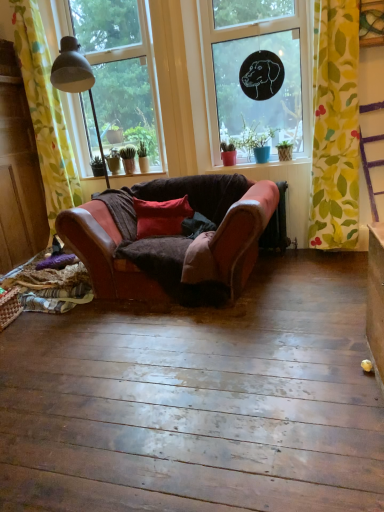
Describe the element at coordinates (120, 71) in the screenshot. I see `transparent glass window at upper left, which ranks as the 2th window in right-to-left order` at that location.

Measure the distance between leather couch at center and camera.

The distance of leather couch at center from camera is 2.50 meters.

What is the approximate height of yellow floral fabric at right, which appears as the first curtain when viewed from the right?

yellow floral fabric at right, which appears as the first curtain when viewed from the right, is 1.87 meters in height.

This screenshot has width=384, height=512. Find the location of `matte red pot at center`. matte red pot at center is located at coordinates (249, 139).

This screenshot has width=384, height=512. In order to click on curtain that is the 2nd one when counting forward from the matte red pot at center in this screenshot , I will do click(335, 126).

From the image's perspective, is yellow floral fabric at right, positioned as the second curtain in left-to-right order, below matte red pot at center?

Indeed, from the image's perspective, yellow floral fabric at right, positioned as the second curtain in left-to-right order, is shown beneath matte red pot at center.

Based on the photo, are yellow floral fabric at right, which appears as the first curtain when viewed from the right, and matte red pot at center far apart?

No, yellow floral fabric at right, which appears as the first curtain when viewed from the right, is not far from matte red pot at center.

Is green fabric at lower left turned away from matte red pot at center?

No, green fabric at lower left is not facing the opposite direction of matte red pot at center.

Is green fabric at lower left to the right of matte red pot at center from the viewer's perspective?

In fact, green fabric at lower left is to the left of matte red pot at center.

Between green fabric at lower left and matte red pot at center, which one is positioned in front?

matte red pot at center.

Is transparent glass window at upper center, arranged as the 2th window when viewed from the left, spatially inside matte red pot at center, or outside of it?

The correct answer is: outside.

How different are the orientations of transparent glass window at upper center, the 1th window when ordered from right to left, and matte red pot at center in degrees?

transparent glass window at upper center, the 1th window when ordered from right to left, and matte red pot at center are facing 0.0934 degrees away from each other.

Does transparent glass window at upper center, the 1th window when ordered from right to left, lie in front of matte red pot at center?

That is True.

Is transparent glass window at upper center, the 1th window when ordered from right to left, oriented towards green fabric at lower left?

No, transparent glass window at upper center, the 1th window when ordered from right to left, does not turn towards green fabric at lower left.

Looking at this image, based on their positions, is transparent glass window at upper center, arranged as the 2th window when viewed from the left, located to the left or right of green fabric at lower left?

From the image, it's evident that transparent glass window at upper center, arranged as the 2th window when viewed from the left, is to the right of green fabric at lower left.

Who is taller, transparent glass window at upper center, the 1th window when ordered from right to left, or green fabric at lower left?

transparent glass window at upper center, the 1th window when ordered from right to left, is taller.

Measure the distance from transparent glass window at upper center, arranged as the 2th window when viewed from the left, to green fabric at lower left.

They are 1.14 meters apart.

Based on their sizes in the image, would you say green fabric at lower left is bigger or smaller than transparent glass window at upper left, the first window positioned from the left?

In the image, green fabric at lower left appears to be smaller than transparent glass window at upper left, the first window positioned from the left.

At what (x,y) coordinates should I click in order to perform the action: click on window sill below the transparent glass window at upper left, the first window positioned from the left (from the image's perspective). Please return your answer as a coordinate pair (x, y). Looking at the image, I should click on (134, 178).

Is green fabric at lower left positioned with its back to transparent glass window at upper left, the first window positioned from the left?

green fabric at lower left does not have its back to transparent glass window at upper left, the first window positioned from the left.

Is green fabric at lower left wider than transparent glass window at upper left, the first window positioned from the left?

Correct, the width of green fabric at lower left exceeds that of transparent glass window at upper left, the first window positioned from the left.

Is green fabric at lower left surrounded by leather couch at center?

No.

You are a GUI agent. You are given a task and a screenshot of the screen. Output one action in this format:
    pyautogui.click(x=<x>, y=<y>)
    Task: Click on the studio couch lying on the right of green fabric at lower left
    
    Given the screenshot: What is the action you would take?
    pyautogui.click(x=173, y=240)

Is leather couch at center turned away from green fabric at lower left?

Yes, leather couch at center's orientation is away from green fabric at lower left.

Are leather couch at center and green fabric at lower left making contact?

leather couch at center and green fabric at lower left are not in contact.

Is yellow floral fabric at left, which is the first curtain in left-to-right order, directly adjacent to transparent glass window at upper left, the first window positioned from the left?

yellow floral fabric at left, which is the first curtain in left-to-right order, and transparent glass window at upper left, the first window positioned from the left, are not in contact.

Which is more to the left, yellow floral fabric at left, which is the 2th curtain in right-to-left order, or transparent glass window at upper left, the first window positioned from the left?

yellow floral fabric at left, which is the 2th curtain in right-to-left order, is more to the left.

From a real-world perspective, who is located lower, yellow floral fabric at left, which is the 2th curtain in right-to-left order, or transparent glass window at upper left, the first window positioned from the left?

yellow floral fabric at left, which is the 2th curtain in right-to-left order, from a real-world perspective.

From the image's perspective, between yellow floral fabric at left, which is the 2th curtain in right-to-left order, and transparent glass window at upper left, which ranks as the 2th window in right-to-left order, which one is located above?

transparent glass window at upper left, which ranks as the 2th window in right-to-left order, appears higher in the image.

At what (x,y) coordinates should I click in order to perform the action: click on plant above the yellow floral fabric at right, which appears as the first curtain when viewed from the right (from the image's perspective). Please return your answer as a coordinate pair (x, y). The width and height of the screenshot is (384, 512). Looking at the image, I should click on (249, 139).

In order to click on plant above the green fabric at lower left (from a real-world perspective) in this screenshot , I will do `click(249, 139)`.

Estimate the real-world distances between objects in this image. Which object is closer to matte red cushion at center, matte red pot at center or green fabric at lower left?

green fabric at lower left lies closer to matte red cushion at center than the other object.

Estimate the real-world distances between objects in this image. Which object is closer to leather couch at center, green fabric at lower left or matte red cushion at center?

Based on the image, matte red cushion at center appears to be nearer to leather couch at center.

Considering their positions, is yellow floral fabric at right, which appears as the first curtain when viewed from the right, positioned closer to matte red cushion at center than leather couch at center?

The object closer to matte red cushion at center is leather couch at center.

Looking at the image, which one is located further to yellow floral fabric at left, which is the first curtain in left-to-right order, transparent glass window at upper left, the first window positioned from the left, or green fabric at lower left?

green fabric at lower left lies further to yellow floral fabric at left, which is the first curtain in left-to-right order, than the other object.

Based on their spatial positions, is yellow floral fabric at left, which is the 2th curtain in right-to-left order, or leather couch at center closer to matte red cushion at center?

The object closer to matte red cushion at center is leather couch at center.

Estimate the real-world distances between objects in this image. Which object is further from green fabric at lower left, leather couch at center or transparent glass window at upper center, arranged as the 2th window when viewed from the left?

transparent glass window at upper center, arranged as the 2th window when viewed from the left, lies further to green fabric at lower left than the other object.

Based on their spatial positions, is matte red pot at center or yellow floral fabric at left, which is the 2th curtain in right-to-left order, further from matte red cushion at center?

yellow floral fabric at left, which is the 2th curtain in right-to-left order.

Which object lies further to the anchor point yellow floral fabric at left, which is the 2th curtain in right-to-left order, leather couch at center or transparent glass window at upper left, the first window positioned from the left?

leather couch at center is further to yellow floral fabric at left, which is the 2th curtain in right-to-left order.

The width and height of the screenshot is (384, 512). I want to click on pillow between green fabric at lower left and matte red pot at center from left to right, so click(161, 216).

This screenshot has height=512, width=384. What are the coordinates of `plant between transparent glass window at upper left, which ranks as the 2th window in right-to-left order, and leather couch at center, in the vertical direction` in the screenshot? It's located at (249, 139).

I want to click on window that lies between transparent glass window at upper left, which ranks as the 2th window in right-to-left order, and matte red cushion at center from top to bottom, so click(x=244, y=59).

Image resolution: width=384 pixels, height=512 pixels. I want to click on window sill between transparent glass window at upper left, which ranks as the 2th window in right-to-left order, and matte red cushion at center vertically, so click(x=134, y=178).